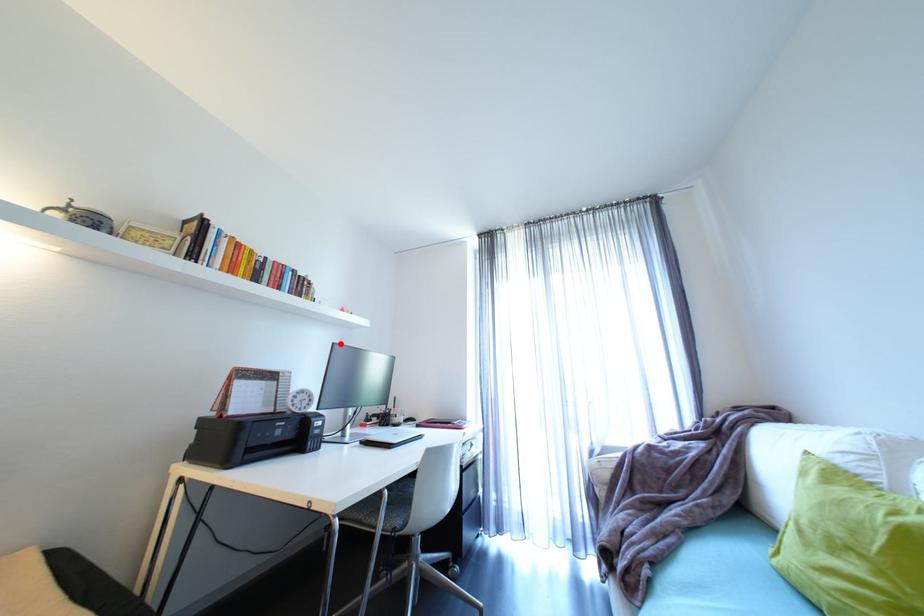
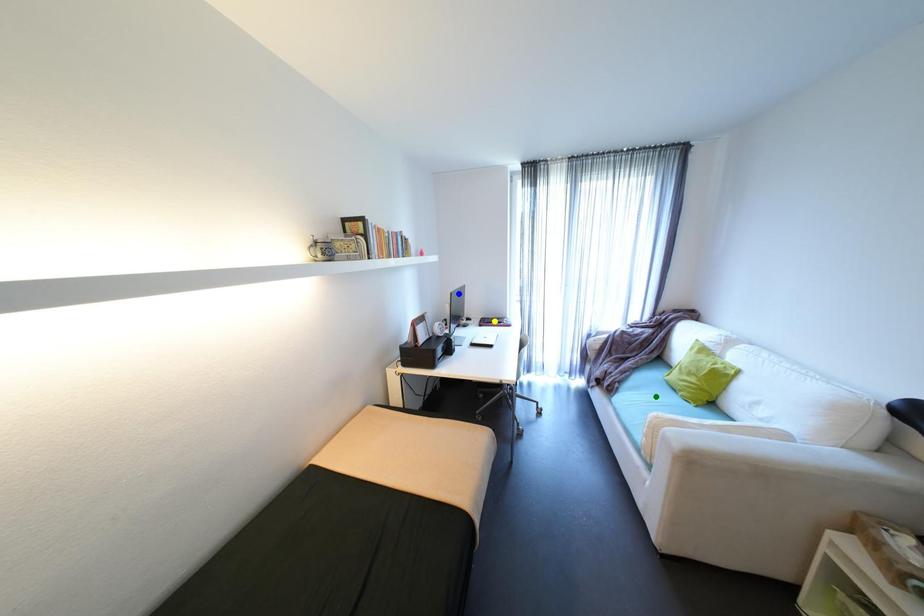
Question: I am providing you with two images of the same scene from different viewpoints. A red point is marked on the first image. You are given multiple points on the second image. In image 2, which mark is for the same physical point as the one in image 1?

Choices:
 (A) blue point
 (B) yellow point
 (C) green point

Answer: (A)